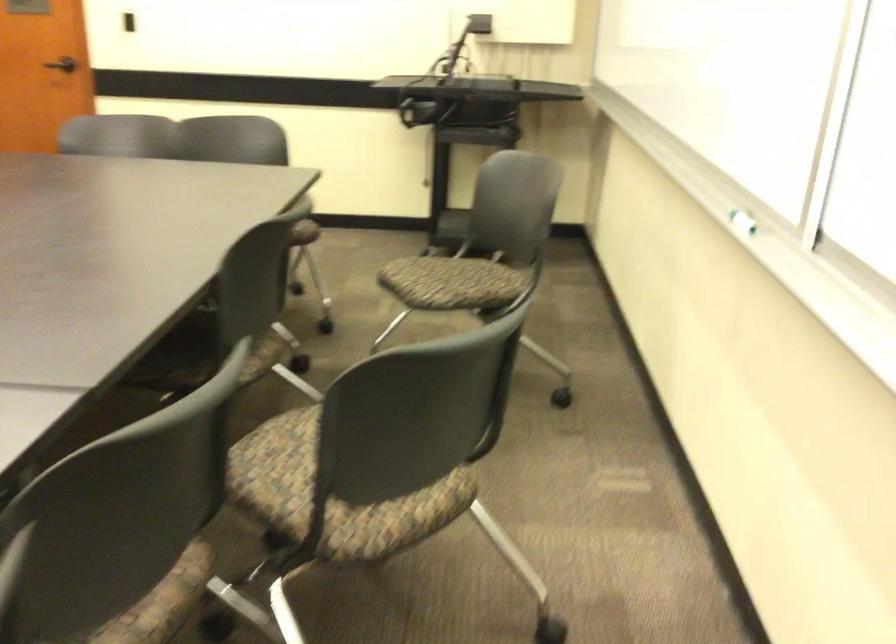
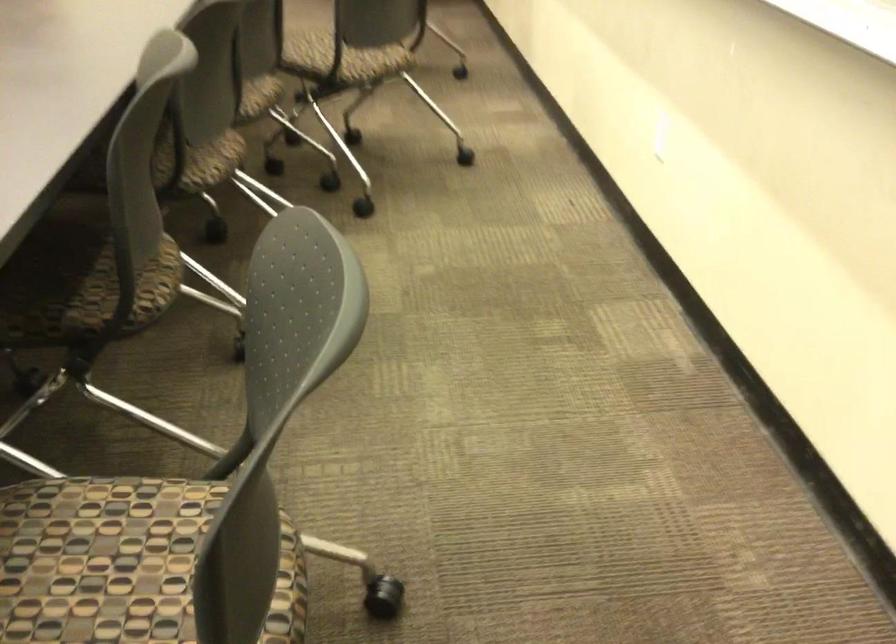
Where in the second image is the point corresponding to (337,476) from the first image?

(337, 57)